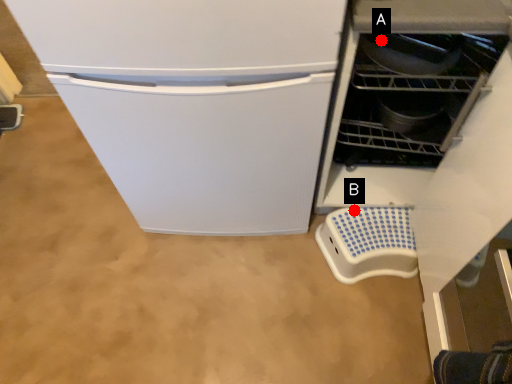
Question: Two points are circled on the image, labeled by A and B beside each circle. Which of the following is the closest to the observer?

Choices:
 (A) A is closer
 (B) B is closer

Answer: (A)